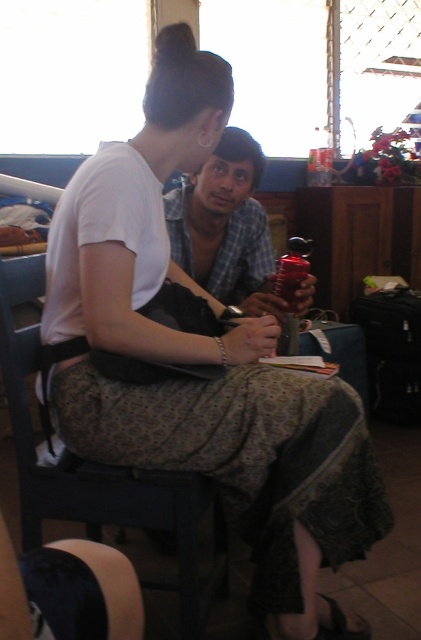
Question: Is dark wood chair at center below matte plastic water bottle at center?

Choices:
 (A) no
 (B) yes

Answer: (B)

Question: Which of the following is the farthest from the observer?

Choices:
 (A) matte plastic water bottle at center
 (B) dark wood chair at center

Answer: (A)

Question: Which point is closer to the camera?

Choices:
 (A) (210, 291)
 (B) (159, 580)

Answer: (B)

Question: Among these points, which one is nearest to the camera?

Choices:
 (A) (194, 252)
 (B) (64, 476)

Answer: (B)

Question: Is dark wood chair at center below matte plastic water bottle at center?

Choices:
 (A) yes
 (B) no

Answer: (A)

Question: Is dark wood chair at center thinner than matte plastic water bottle at center?

Choices:
 (A) yes
 (B) no

Answer: (B)